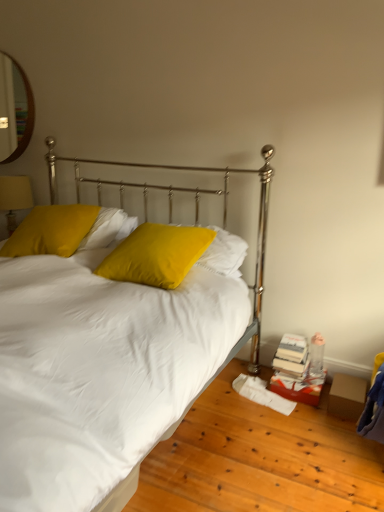
What do you see at coordinates (51, 231) in the screenshot? I see `matte yellow pillow at upper left, positioned as the 1th pillow in left-to-right order` at bounding box center [51, 231].

Measure the distance between point (25, 125) and camera.

Point (25, 125) is 3.45 meters from camera.

What do you see at coordinates (156, 255) in the screenshot? I see `matte yellow pillow at center, placed as the first pillow when sorted from right to left` at bounding box center [156, 255].

Locate an element on the screen. matte yellow pillow at upper left, the second pillow in the right-to-left sequence is located at coordinates (51, 231).

Is wooden framed mirror at upper left not close to matte yellow fabric at left?

Yes, wooden framed mirror at upper left is far from matte yellow fabric at left.

Is wooden framed mirror at upper left to the left or to the right of matte yellow fabric at left in the image?

From the image, it's evident that wooden framed mirror at upper left is to the right of matte yellow fabric at left.

Does wooden framed mirror at upper left have a larger size compared to matte yellow fabric at left?

No, wooden framed mirror at upper left is not bigger than matte yellow fabric at left.

Considering the sizes of matte yellow pillow at upper left, positioned as the 1th pillow in left-to-right order, and white satin bed at center in the image, is matte yellow pillow at upper left, positioned as the 1th pillow in left-to-right order, taller or shorter than white satin bed at center?

Clearly, matte yellow pillow at upper left, positioned as the 1th pillow in left-to-right order, is shorter compared to white satin bed at center.

How far apart are matte yellow pillow at upper left, the second pillow in the right-to-left sequence, and white satin bed at center?

matte yellow pillow at upper left, the second pillow in the right-to-left sequence, and white satin bed at center are 66.01 centimeters apart.

Consider the image. Is matte yellow pillow at upper left, the second pillow in the right-to-left sequence, closer to camera compared to white satin bed at center?

That is False.

Can you confirm if matte yellow pillow at upper left, positioned as the 1th pillow in left-to-right order, is wider than white satin bed at center?

Incorrect, the width of matte yellow pillow at upper left, positioned as the 1th pillow in left-to-right order, does not surpass that of white satin bed at center.

Is white satin bed at center positioned far away from wooden framed mirror at upper left?

Indeed, white satin bed at center is not near wooden framed mirror at upper left.

Measure the distance from white satin bed at center to wooden framed mirror at upper left.

white satin bed at center is 1.68 meters from wooden framed mirror at upper left.

Is white satin bed at center outside of wooden framed mirror at upper left?

Absolutely, white satin bed at center is external to wooden framed mirror at upper left.

Which object is further away from the camera, white satin bed at center or wooden framed mirror at upper left?

wooden framed mirror at upper left is further away from the camera.

From the picture: Is the position of matte yellow pillow at center, placed as the first pillow when sorted from right to left, more distant than that of wooden framed mirror at upper left?

No, matte yellow pillow at center, placed as the first pillow when sorted from right to left, is closer to the camera.

From the image's perspective, is matte yellow pillow at center, which is the 2th pillow in left-to-right order, on top of wooden framed mirror at upper left?

No, from the image's perspective, matte yellow pillow at center, which is the 2th pillow in left-to-right order, is not on top of wooden framed mirror at upper left.

Can you confirm if matte yellow pillow at center, placed as the first pillow when sorted from right to left, is smaller than wooden framed mirror at upper left?

No, matte yellow pillow at center, placed as the first pillow when sorted from right to left, is not smaller than wooden framed mirror at upper left.

From a real-world perspective, which object rests below the other?

matte yellow pillow at center, placed as the first pillow when sorted from right to left, is physically lower.

Between point (17, 105) and point (122, 196), which one is positioned in front?

The point (122, 196) is closer to the camera.

Is wooden framed mirror at upper left wider or thinner than white satin bed at center?

Considering their sizes, wooden framed mirror at upper left looks slimmer than white satin bed at center.

Consider the image. From a real-world perspective, which object rests below the other?

white satin bed at center.

Who is smaller, wooden framed mirror at upper left or white satin bed at center?

wooden framed mirror at upper left is smaller.

What's the angular difference between matte yellow fabric at left and matte yellow pillow at center, placed as the first pillow when sorted from right to left,'s facing directions?

3.73 degrees.

Could you tell me if matte yellow fabric at left is turned towards matte yellow pillow at center, which is the 2th pillow in left-to-right order?

No, matte yellow fabric at left is not turned towards matte yellow pillow at center, which is the 2th pillow in left-to-right order.

From the image's perspective, which is below, matte yellow fabric at left or matte yellow pillow at center, which is the 2th pillow in left-to-right order?

matte yellow pillow at center, which is the 2th pillow in left-to-right order, appears lower in the image.

From a real-world perspective, is matte yellow fabric at left physically below matte yellow pillow at center, placed as the first pillow when sorted from right to left?

Yes.

Based on the photo, considering the relative positions of wooden framed mirror at upper left and matte yellow pillow at center, which is the 2th pillow in left-to-right order, in the image provided, is wooden framed mirror at upper left to the right of matte yellow pillow at center, which is the 2th pillow in left-to-right order, from the viewer's perspective?

No, wooden framed mirror at upper left is not to the right of matte yellow pillow at center, which is the 2th pillow in left-to-right order.

Which object is more forward, wooden framed mirror at upper left or matte yellow pillow at center, which is the 2th pillow in left-to-right order?

matte yellow pillow at center, which is the 2th pillow in left-to-right order, is more forward.

What's the angular difference between wooden framed mirror at upper left and matte yellow pillow at center, which is the 2th pillow in left-to-right order,'s facing directions?

The angle between the facing direction of wooden framed mirror at upper left and the facing direction of matte yellow pillow at center, which is the 2th pillow in left-to-right order, is 2.12 degrees.

At what (x,y) coordinates should I click in order to perform the action: click on mirror above the matte yellow fabric at left (from a real-world perspective). Please return your answer as a coordinate pair (x, y). The width and height of the screenshot is (384, 512). Looking at the image, I should click on (14, 109).

Locate an element on the screen. This screenshot has width=384, height=512. bed to the right of matte yellow pillow at upper left, the second pillow in the right-to-left sequence is located at coordinates (224, 227).

Considering their positions, is matte yellow pillow at upper left, the second pillow in the right-to-left sequence, positioned closer to wooden framed mirror at upper left than matte yellow pillow at center, placed as the first pillow when sorted from right to left?

matte yellow pillow at upper left, the second pillow in the right-to-left sequence, is closer to wooden framed mirror at upper left.

Looking at the image, which one is located closer to matte yellow fabric at left, matte yellow pillow at center, placed as the first pillow when sorted from right to left, or wooden framed mirror at upper left?

wooden framed mirror at upper left is closer to matte yellow fabric at left.

Considering their positions, is wooden framed mirror at upper left positioned closer to white satin bed at center than matte yellow pillow at center, placed as the first pillow when sorted from right to left?

matte yellow pillow at center, placed as the first pillow when sorted from right to left, is positioned closer to the anchor white satin bed at center.

Which object lies nearer to the anchor point wooden framed mirror at upper left, matte yellow pillow at center, which is the 2th pillow in left-to-right order, or matte yellow fabric at left?

matte yellow fabric at left lies closer to wooden framed mirror at upper left than the other object.

Estimate the real-world distances between objects in this image. Which object is further from matte yellow pillow at upper left, positioned as the 1th pillow in left-to-right order, matte yellow pillow at center, placed as the first pillow when sorted from right to left, or white satin bed at center?

The object further to matte yellow pillow at upper left, positioned as the 1th pillow in left-to-right order, is white satin bed at center.

Consider the image. Based on their spatial positions, is matte yellow fabric at left or wooden framed mirror at upper left closer to matte yellow pillow at upper left, the second pillow in the right-to-left sequence?

Among the two, matte yellow fabric at left is located nearer to matte yellow pillow at upper left, the second pillow in the right-to-left sequence.

Which object lies nearer to the anchor point matte yellow pillow at upper left, positioned as the 1th pillow in left-to-right order, matte yellow pillow at center, which is the 2th pillow in left-to-right order, or matte yellow fabric at left?

matte yellow pillow at center, which is the 2th pillow in left-to-right order.

Based on their spatial positions, is matte yellow fabric at left or wooden framed mirror at upper left closer to matte yellow pillow at center, which is the 2th pillow in left-to-right order?

matte yellow fabric at left lies closer to matte yellow pillow at center, which is the 2th pillow in left-to-right order, than the other object.

Image resolution: width=384 pixels, height=512 pixels. In order to click on pillow between white satin bed at center and matte yellow pillow at upper left, the second pillow in the right-to-left sequence, from front to back in this screenshot , I will do point(156,255).

At what (x,y) coordinates should I click in order to perform the action: click on table lamp between wooden framed mirror at upper left and matte yellow pillow at upper left, positioned as the 1th pillow in left-to-right order, vertically. Please return your answer as a coordinate pair (x, y). The image size is (384, 512). Looking at the image, I should click on (14, 198).

Locate an element on the screen. pillow located between wooden framed mirror at upper left and matte yellow pillow at center, which is the 2th pillow in left-to-right order, in the left-right direction is located at coordinates (51, 231).

The width and height of the screenshot is (384, 512). I want to click on pillow located between matte yellow fabric at left and matte yellow pillow at center, placed as the first pillow when sorted from right to left, in the left-right direction, so click(x=51, y=231).